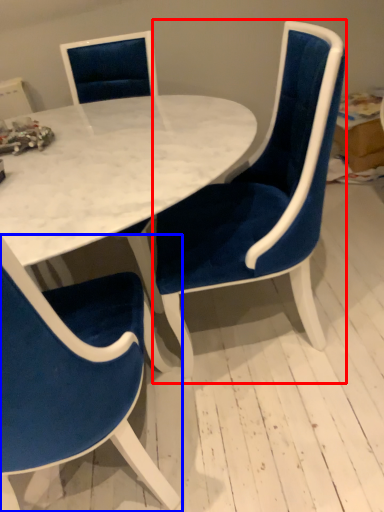
Question: Which point is closer to the camera, chair (highlighted by a red box) or chair (highlighted by a blue box)?

Choices:
 (A) chair
 (B) chair

Answer: (B)